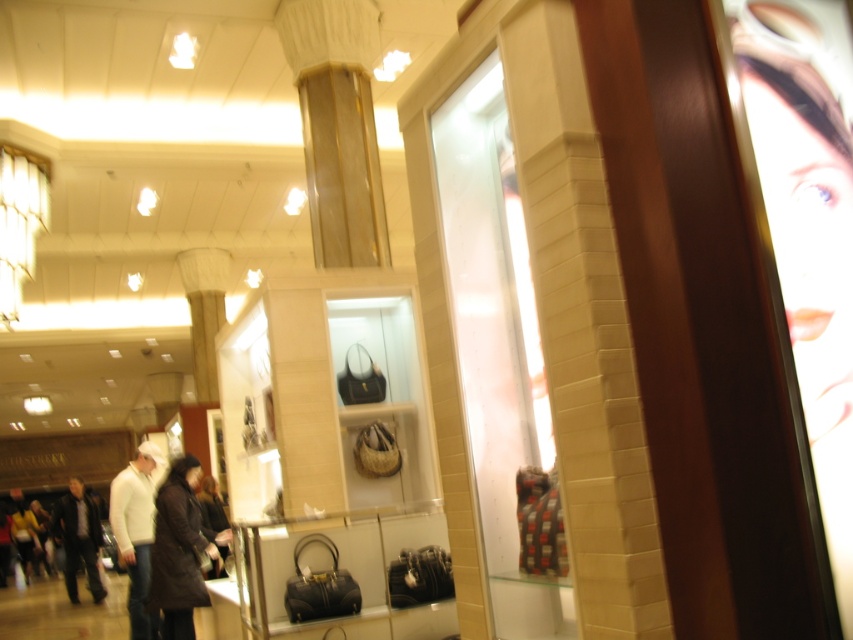
You are standing in the luxury retail store and looking at the display case. There are two points marked on the display case at coordinates point (195, 560) and point (67, 589). Which point is closer to you?

Point (195, 560) is closer to the viewer than point (67, 589).

You are a customer in the store and want to take a photo of the dark brown leather jacket at center. You have a camera that has a maximum focus range of 15 feet. Can you take a clear photo without moving closer?

A: The dark brown leather jacket at center and camera are 16.31 feet apart, which exceeds the camera maximum focus range of 15 feet. Therefore, you cannot take a clear photo without moving closer.